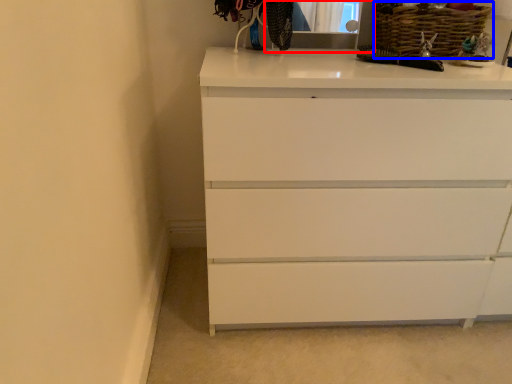
Question: Which point is further to the camera, medicine cabinet (highlighted by a red box) or basket (highlighted by a blue box)?

Choices:
 (A) medicine cabinet
 (B) basket

Answer: (B)